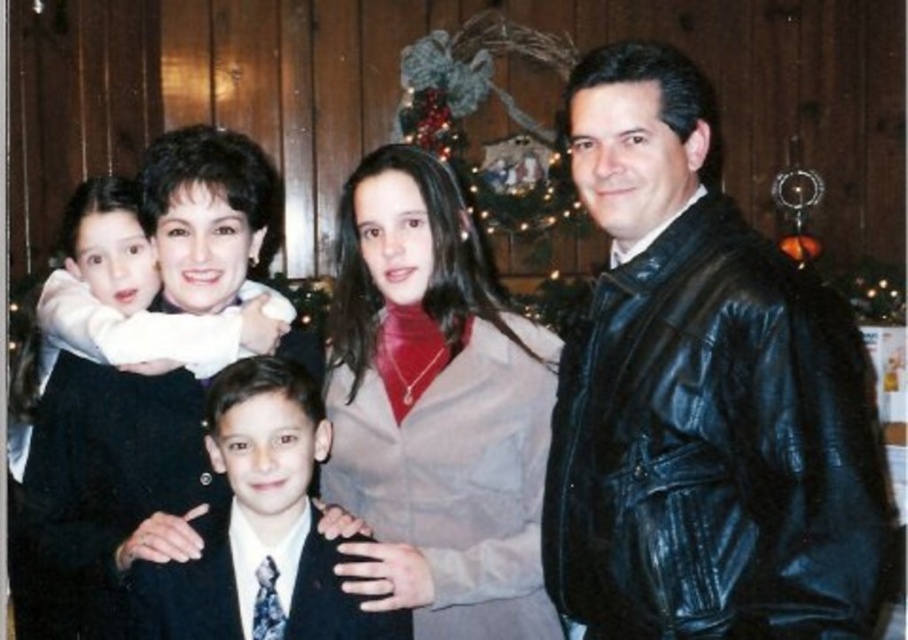
You are a tailor who needs to determine which suit requires more fabric for alterations. Based on the image, which suit would need more fabric, the matte black suit at left or the dark blue suit at center?

The matte black suit at left requires more fabric for alterations since it is larger in size than the dark blue suit at center.

You are standing in the room and want to place a small decoration on the point closer to you between the two points marked as point (630, 444) and point (318, 512). Which point should you choose?

You should choose point (630, 444) because it is closer to you than point (318, 512).

Based on the photo, you are a photographer setting up for a family photo. The family will stand between the black leather jacket at right and the matte black suit at left. The minimum distance required for your camera to focus properly is 1 meter. Will the space between the jacket and the suit be sufficient?

The black leather jacket at right is 1.01 meters from the matte black suit at left. Since the minimum focus distance required is 1 meter, the space between them is just enough for the camera to focus properly.